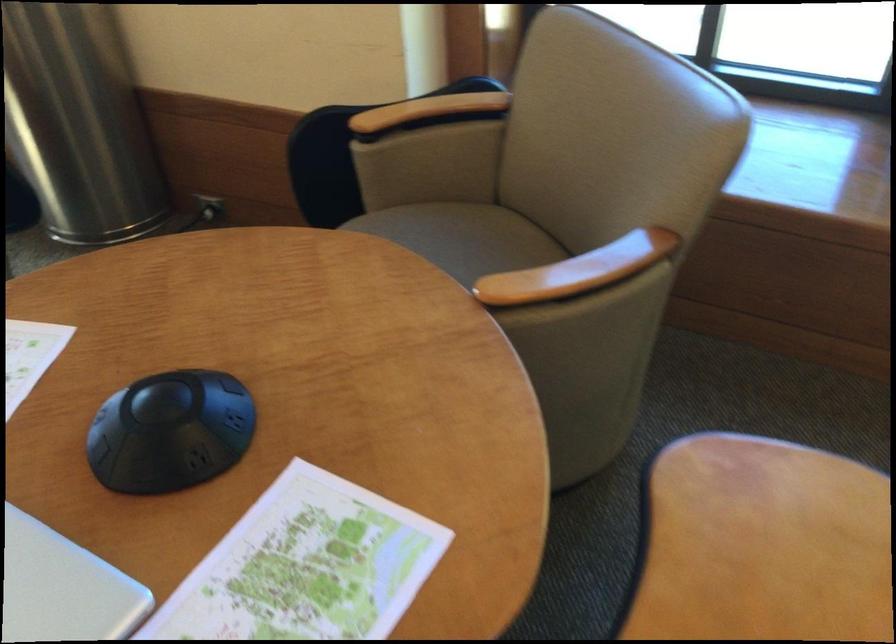
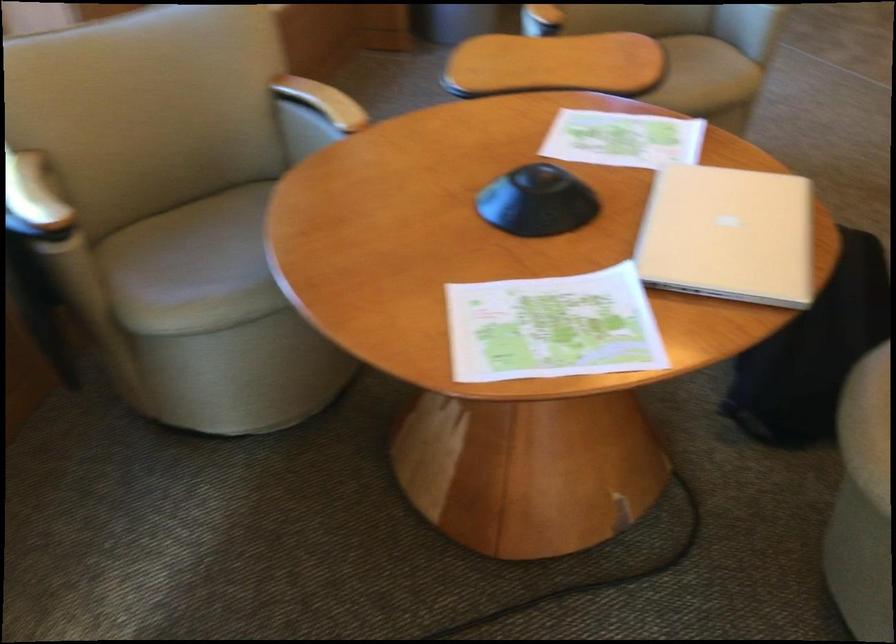
The point at (x=428, y=298) is marked in the first image. Where is the corresponding point in the second image?

(193, 267)